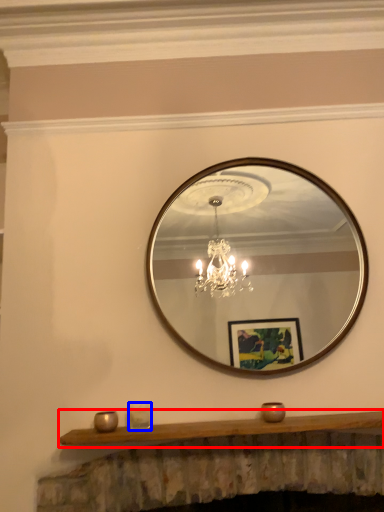
Question: Which of the following is the closest to the observer, mantle (highlighted by a red box) or candle holder (highlighted by a blue box)?

Choices:
 (A) mantle
 (B) candle holder

Answer: (A)